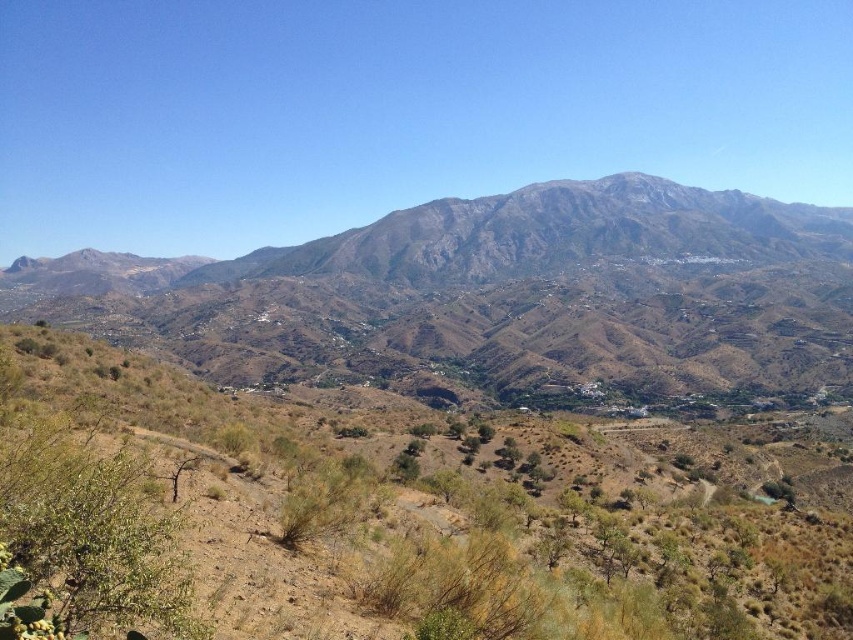
Question: Which point is farther from the camera taking this photo?

Choices:
 (A) (200, 508)
 (B) (476, 333)

Answer: (B)

Question: Is dry shrubbery at center to the left of rugged brown mountain range at center from the viewer's perspective?

Choices:
 (A) no
 (B) yes

Answer: (B)

Question: Among these objects, which one is farthest from the camera?

Choices:
 (A) rugged brown mountain range at center
 (B) dry shrubbery at center

Answer: (A)

Question: Does dry shrubbery at center have a lesser width compared to rugged brown mountain range at center?

Choices:
 (A) yes
 (B) no

Answer: (A)

Question: Is dry shrubbery at center positioned at the back of rugged brown mountain range at center?

Choices:
 (A) no
 (B) yes

Answer: (A)